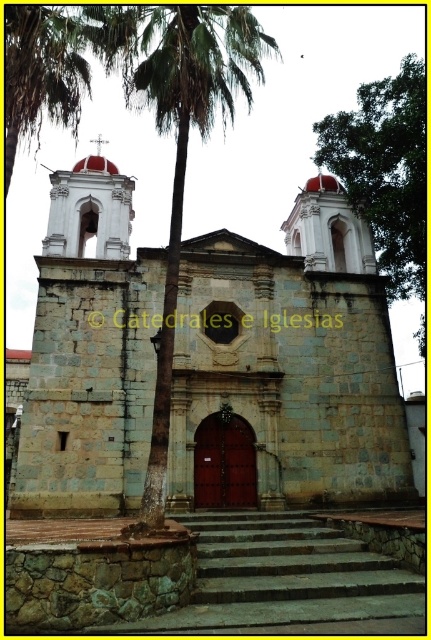
Question: Estimate the real-world distances between objects in this image. Which object is closer to the stone church at center?

Choices:
 (A) green leafy palm tree at center
 (B) green leafy tree at right

Answer: (A)

Question: Which point appears farthest from the camera in this image?

Choices:
 (A) (84, 202)
 (B) (214, 52)

Answer: (A)

Question: In this image, where is green leafy palm tree at center located relative to green leafy tree at right?

Choices:
 (A) left
 (B) right

Answer: (A)

Question: Is stone church at center smaller than green leafy palm tree at center?

Choices:
 (A) no
 (B) yes

Answer: (A)

Question: Which object appears closest to the camera in this image?

Choices:
 (A) stone church at center
 (B) green leafy tree at right

Answer: (A)

Question: Is stone church at center to the right of green leafy palm tree at center from the viewer's perspective?

Choices:
 (A) yes
 (B) no

Answer: (A)